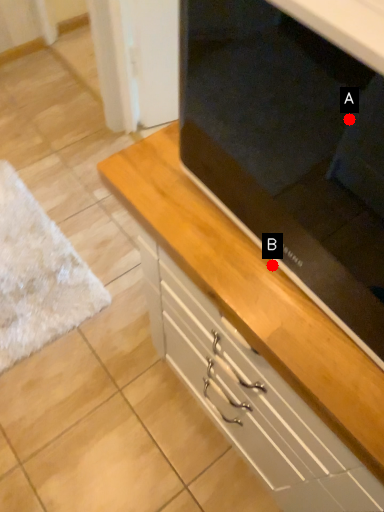
Question: Two points are circled on the image, labeled by A and B beside each circle. Among these points, which one is nearest to the camera?

Choices:
 (A) A is closer
 (B) B is closer

Answer: (B)